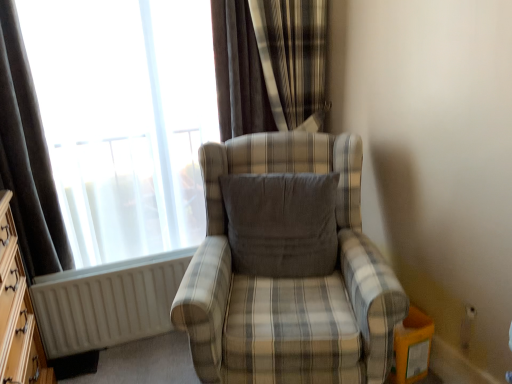
Question: From the image's perspective, is gray fabric pillow at center under wooden dresser at left?

Choices:
 (A) yes
 (B) no

Answer: (B)

Question: From the image's perspective, does gray fabric pillow at center appear higher than wooden dresser at left?

Choices:
 (A) no
 (B) yes

Answer: (B)

Question: Considering the relative positions of gray fabric pillow at center and wooden dresser at left in the image provided, is gray fabric pillow at center to the right of wooden dresser at left from the viewer's perspective?

Choices:
 (A) no
 (B) yes

Answer: (B)

Question: Is gray fabric pillow at center smaller than wooden dresser at left?

Choices:
 (A) yes
 (B) no

Answer: (A)

Question: Is gray fabric pillow at center closer to camera compared to wooden dresser at left?

Choices:
 (A) yes
 (B) no

Answer: (B)

Question: In terms of height, does matte glass window at upper left look taller or shorter compared to gray fabric pillow at center?

Choices:
 (A) tall
 (B) short

Answer: (A)

Question: In terms of width, does matte glass window at upper left look wider or thinner when compared to gray fabric pillow at center?

Choices:
 (A) thin
 (B) wide

Answer: (A)

Question: Choose the correct answer: Is matte glass window at upper left inside gray fabric pillow at center or outside it?

Choices:
 (A) inside
 (B) outside

Answer: (B)

Question: From the image's perspective, is matte glass window at upper left positioned above or below gray fabric pillow at center?

Choices:
 (A) below
 (B) above

Answer: (B)

Question: From the image's perspective, is white matte radiator at lower left positioned above or below velvet-like brown curtain at upper center, positioned as the first curtain in right-to-left order?

Choices:
 (A) above
 (B) below

Answer: (B)

Question: Considering the positions of white matte radiator at lower left and velvet-like brown curtain at upper center, which ranks as the second curtain in left-to-right order, in the image, is white matte radiator at lower left wider or thinner than velvet-like brown curtain at upper center, which ranks as the second curtain in left-to-right order,?

Choices:
 (A) thin
 (B) wide

Answer: (A)

Question: Choose the correct answer: Is white matte radiator at lower left inside velvet-like brown curtain at upper center, which ranks as the second curtain in left-to-right order, or outside it?

Choices:
 (A) outside
 (B) inside

Answer: (A)

Question: From a real-world perspective, relative to velvet-like brown curtain at upper center, positioned as the first curtain in right-to-left order, is white matte radiator at lower left vertically above or below?

Choices:
 (A) below
 (B) above

Answer: (A)

Question: Is gray fabric pillow at center inside or outside of white matte radiator at lower left?

Choices:
 (A) outside
 (B) inside

Answer: (A)

Question: In terms of size, does gray fabric pillow at center appear bigger or smaller than white matte radiator at lower left?

Choices:
 (A) big
 (B) small

Answer: (A)